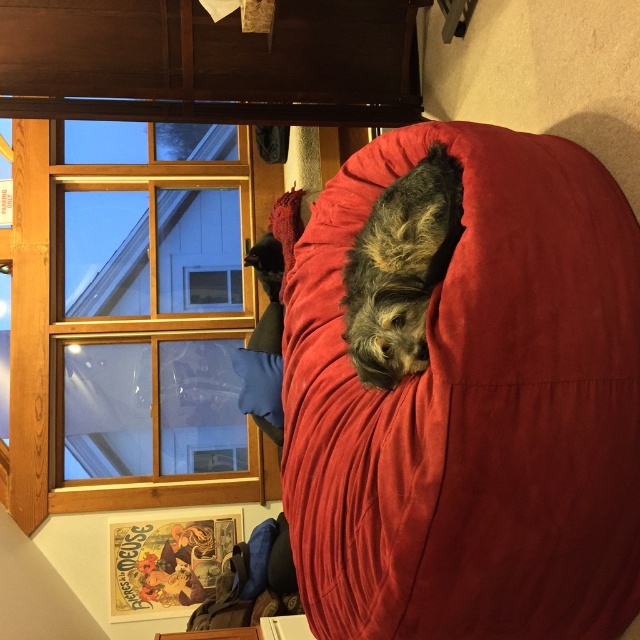
Is suede-like red bean bag at center taller than wooden frame at upper left?

No, suede-like red bean bag at center is not taller than wooden frame at upper left.

How much distance is there between suede-like red bean bag at center and wooden frame at upper left?

suede-like red bean bag at center is 9.16 feet away from wooden frame at upper left.

At what (x,y) coordinates should I click in order to perform the action: click on suede-like red bean bag at center. Please return your answer as a coordinate pair (x, y). The image size is (640, 640). Looking at the image, I should click on (474, 408).

Does wooden frame at upper left have a lesser height compared to shaggy brown dog at center?

No, wooden frame at upper left is not shorter than shaggy brown dog at center.

Who is lower down, wooden frame at upper left or shaggy brown dog at center?

wooden frame at upper left

Does point (141, 170) come behind point (440, 150)?

Yes, it is.

Where is `wooden frame at upper left`? wooden frame at upper left is located at coordinates (156, 323).

Who is more forward, (506, 352) or (355, 369)?

Point (506, 352) is in front.

Between point (435, 563) and point (371, 323), which one is positioned in front?

Positioned in front is point (435, 563).

Where is `suede-like red bean bag at center`? The height and width of the screenshot is (640, 640). suede-like red bean bag at center is located at coordinates (474, 408).